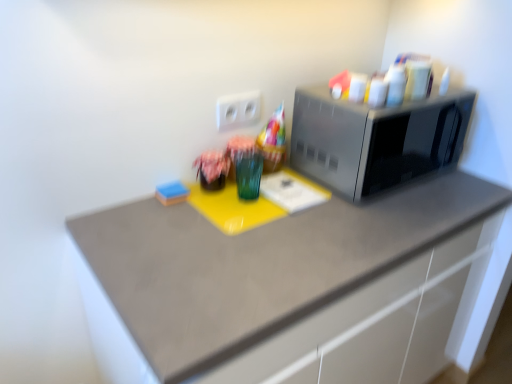
This screenshot has height=384, width=512. I want to click on vacant space that is to the left of green glass at center, so click(174, 219).